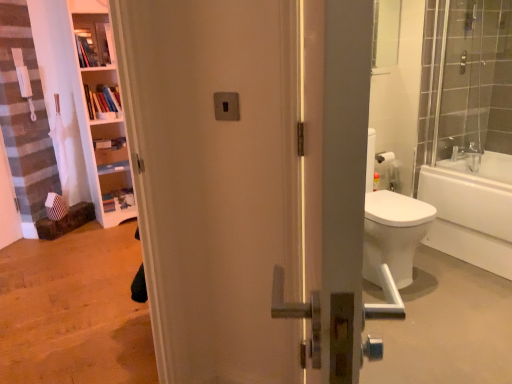
Question: Is white glossy bathtub at right positioned behind wooden shelves at upper left, positioned as the second shelf in bottom-to-top order?

Choices:
 (A) yes
 (B) no

Answer: (B)

Question: Can you confirm if white glossy bathtub at right is shorter than wooden shelves at upper left, positioned as the second shelf in bottom-to-top order?

Choices:
 (A) yes
 (B) no

Answer: (B)

Question: Is white glossy bathtub at right taller than wooden shelves at upper left, positioned as the first shelf in top-to-bottom order?

Choices:
 (A) yes
 (B) no

Answer: (A)

Question: Is white glossy bathtub at right looking in the opposite direction of wooden shelves at upper left, positioned as the first shelf in top-to-bottom order?

Choices:
 (A) yes
 (B) no

Answer: (B)

Question: Is white glossy bathtub at right in front of wooden shelves at upper left, positioned as the second shelf in bottom-to-top order?

Choices:
 (A) no
 (B) yes

Answer: (B)

Question: From the image's perspective, is white glossy bathtub at right under wooden shelves at upper left, positioned as the first shelf in top-to-bottom order?

Choices:
 (A) no
 (B) yes

Answer: (B)

Question: From the image's perspective, is clear glass shower door at right beneath wooden shelves at upper left, positioned as the first shelf in top-to-bottom order?

Choices:
 (A) no
 (B) yes

Answer: (B)

Question: Is wooden shelves at upper left, positioned as the second shelf in bottom-to-top order, surrounded by clear glass shower door at right?

Choices:
 (A) yes
 (B) no

Answer: (B)

Question: Does clear glass shower door at right appear on the left side of wooden shelves at upper left, positioned as the first shelf in top-to-bottom order?

Choices:
 (A) no
 (B) yes

Answer: (A)

Question: Is clear glass shower door at right placed right next to wooden shelves at upper left, positioned as the second shelf in bottom-to-top order?

Choices:
 (A) yes
 (B) no

Answer: (B)

Question: Could you tell me if clear glass shower door at right is turned towards wooden shelves at upper left, positioned as the first shelf in top-to-bottom order?

Choices:
 (A) no
 (B) yes

Answer: (A)

Question: Is clear glass shower door at right wider than wooden shelves at upper left, positioned as the second shelf in bottom-to-top order?

Choices:
 (A) no
 (B) yes

Answer: (A)

Question: Considering the relative positions of wooden bookshelf at upper left, placed as the second shelf when sorted from top to bottom, and wooden shelves at upper left, positioned as the second shelf in bottom-to-top order, in the image provided, is wooden bookshelf at upper left, placed as the second shelf when sorted from top to bottom, to the right of wooden shelves at upper left, positioned as the second shelf in bottom-to-top order, from the viewer's perspective?

Choices:
 (A) no
 (B) yes

Answer: (B)